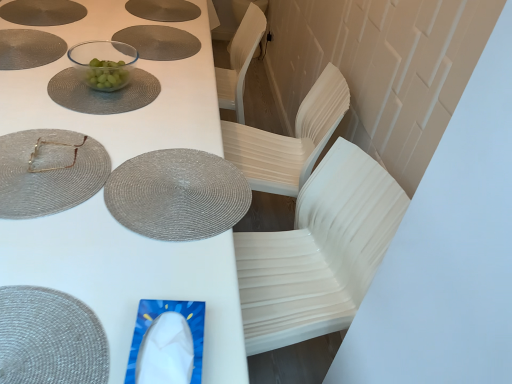
At what (x,y) coordinates should I click in order to perform the action: click on free space that is in between matte silver placemat at upper left, the 1th platter in the left-to-right sequence, and gold metallic square at upper left, placed as the 3th tableware when sorted from bottom to top. Please return your answer as a coordinate pair (x, y). The height and width of the screenshot is (384, 512). Looking at the image, I should click on (41, 62).